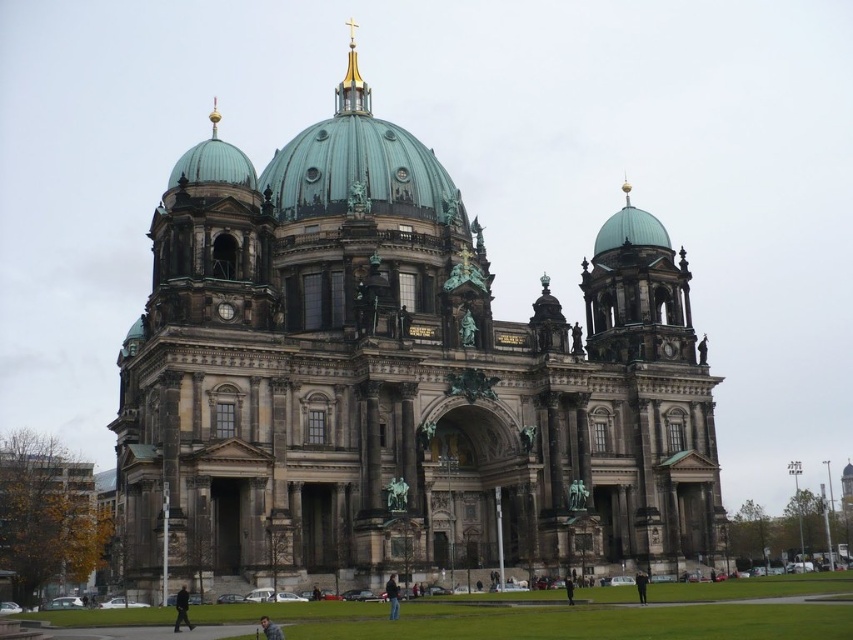
Between point (335, 100) and point (393, 612), which one is positioned behind?

The point (335, 100) is more distant.

This screenshot has height=640, width=853. What are the coordinates of `gold plated spire at upper center` in the screenshot? It's located at (351, 83).

This screenshot has width=853, height=640. In order to click on gold plated spire at upper center in this screenshot , I will do `click(351, 83)`.

At what (x,y) coordinates should I click in order to perform the action: click on dark gray stone church at center. Please return your answer as a coordinate pair (x, y). Looking at the image, I should click on (397, 384).

Between point (534, 340) and point (390, 573), which one is positioned in front?

Positioned in front is point (390, 573).

Is point (285, 483) positioned before point (387, 588)?

No, (285, 483) is further to viewer.

Locate an element on the screen. The image size is (853, 640). dark gray stone church at center is located at coordinates (397, 384).

Is dark gray jacket at lower center behind light brown leather jacket at center?

Yes, it is.

Between point (183, 620) and point (277, 630), which one is positioned in front?

Point (277, 630) is in front.

At what (x,y) coordinates should I click in order to perform the action: click on dark gray jacket at lower center. Please return your answer as a coordinate pair (x, y). Looking at the image, I should click on (181, 609).